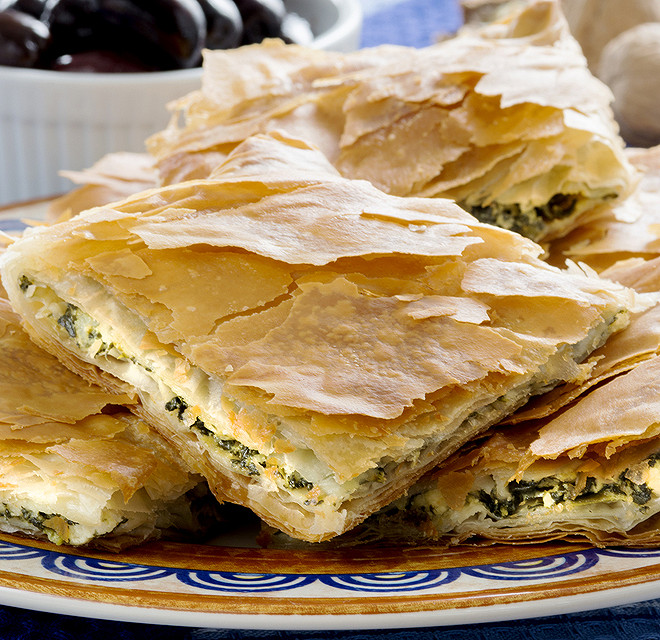
In order to click on white fruit bowl in this screenshot , I will do `click(67, 96)`.